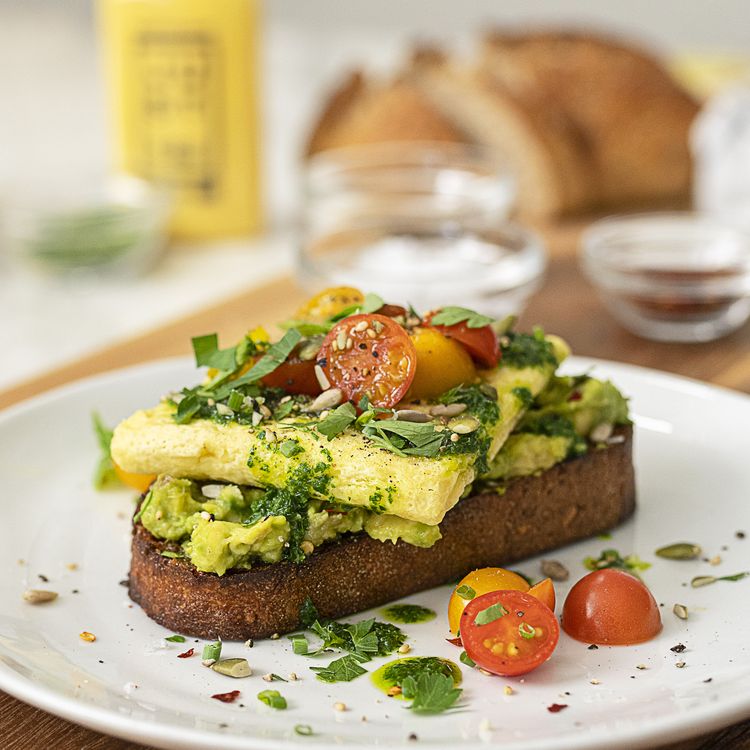
Image resolution: width=750 pixels, height=750 pixels. What are the coordinates of `waterglass` in the screenshot? It's located at (500, 290).